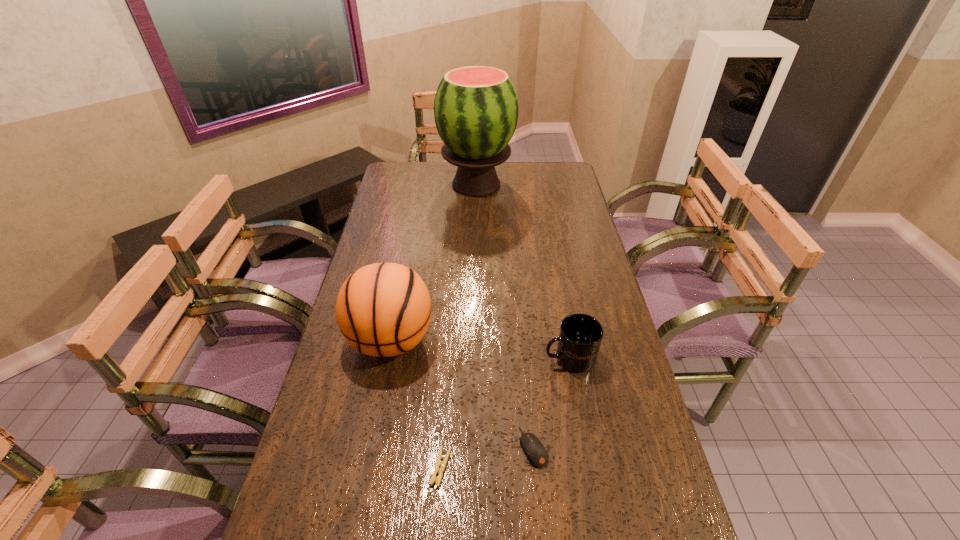
Where is `free space between the watermelon and the basketball`? Image resolution: width=960 pixels, height=540 pixels. free space between the watermelon and the basketball is located at coordinates (434, 262).

The height and width of the screenshot is (540, 960). Find the location of `object that ranks as the third closest to the fourth shortest object`. object that ranks as the third closest to the fourth shortest object is located at coordinates (580, 335).

Identify the location of object that ranks as the third closest to the basketball. This screenshot has height=540, width=960. (580, 335).

The height and width of the screenshot is (540, 960). In order to click on blank area in the image that satisfies the following two spatial constraints: 1. on the front side of the shortest object; 2. on the right side of the basketball in this screenshot , I will do `click(366, 467)`.